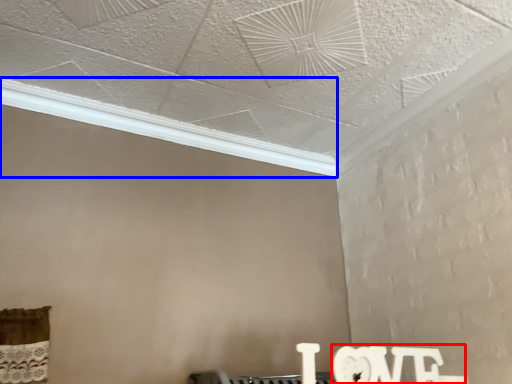
Question: Which point is closer to the camera, writing (highlighted by a red box) or window (highlighted by a blue box)?

Choices:
 (A) writing
 (B) window

Answer: (A)